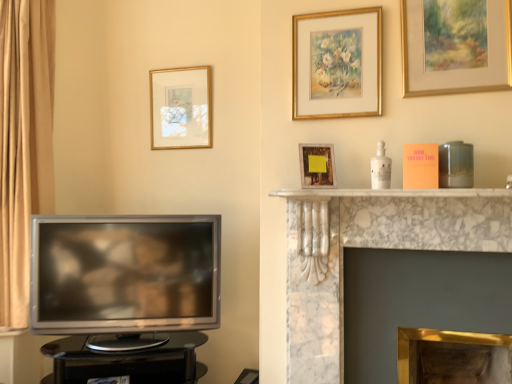
Question: Is white marble fireplace at upper center thinner than gold metallic fireplace at center, the 2th fireplace positioned from the top?

Choices:
 (A) no
 (B) yes

Answer: (A)

Question: Is the depth of white marble fireplace at upper center greater than that of gold metallic fireplace at center, acting as the 1th fireplace starting from the bottom?

Choices:
 (A) yes
 (B) no

Answer: (B)

Question: Does white marble fireplace at upper center have a smaller size compared to gold metallic fireplace at center, acting as the 1th fireplace starting from the bottom?

Choices:
 (A) no
 (B) yes

Answer: (B)

Question: Does white marble fireplace at upper center lie in front of gold metallic fireplace at center, acting as the 1th fireplace starting from the bottom?

Choices:
 (A) yes
 (B) no

Answer: (A)

Question: Can gold metallic fireplace at center, the 2th fireplace positioned from the top, be found inside white marble fireplace at upper center?

Choices:
 (A) yes
 (B) no

Answer: (B)

Question: From a real-world perspective, is gold/gilded picture frame at upper center, the second picture frame in the right-to-left sequence, positioned above or below white marble fireplace at center, acting as the 2th fireplace starting from the bottom?

Choices:
 (A) above
 (B) below

Answer: (A)

Question: Does point (333, 26) appear closer or farther from the camera than point (492, 190)?

Choices:
 (A) closer
 (B) farther

Answer: (B)

Question: Considering the positions of gold/gilded picture frame at upper center, the 3th picture frame positioned from the front, and white marble fireplace at center, which appears as the 1th fireplace when viewed from the top, in the image, is gold/gilded picture frame at upper center, the 3th picture frame positioned from the front, taller or shorter than white marble fireplace at center, which appears as the 1th fireplace when viewed from the top,?

Choices:
 (A) tall
 (B) short

Answer: (B)

Question: Based on their sizes in the image, would you say gold/gilded picture frame at upper center, marked as the 2th picture frame in a back-to-front arrangement, is bigger or smaller than white marble fireplace at center, acting as the 2th fireplace starting from the bottom?

Choices:
 (A) big
 (B) small

Answer: (B)

Question: In terms of height, does gold metallic fireplace at center, the 2th fireplace positioned from the top, look taller or shorter compared to satin silver television at left?

Choices:
 (A) tall
 (B) short

Answer: (B)

Question: From a real-world perspective, is gold metallic fireplace at center, acting as the 1th fireplace starting from the bottom, above or below satin silver television at left?

Choices:
 (A) above
 (B) below

Answer: (B)

Question: Considering the relative positions of gold metallic fireplace at center, acting as the 1th fireplace starting from the bottom, and satin silver television at left in the image provided, is gold metallic fireplace at center, acting as the 1th fireplace starting from the bottom, to the left or to the right of satin silver television at left?

Choices:
 (A) left
 (B) right

Answer: (B)

Question: Is gold metallic fireplace at center, the 2th fireplace positioned from the top, inside the boundaries of satin silver television at left, or outside?

Choices:
 (A) inside
 (B) outside

Answer: (B)

Question: Relative to gold-framed picture at upper center, the 4th picture frame positioned from the right, is white marble fireplace at center, acting as the 2th fireplace starting from the bottom, in front or behind?

Choices:
 (A) front
 (B) behind

Answer: (A)

Question: Is point (317, 271) closer or farther from the camera than point (199, 89)?

Choices:
 (A) closer
 (B) farther

Answer: (A)